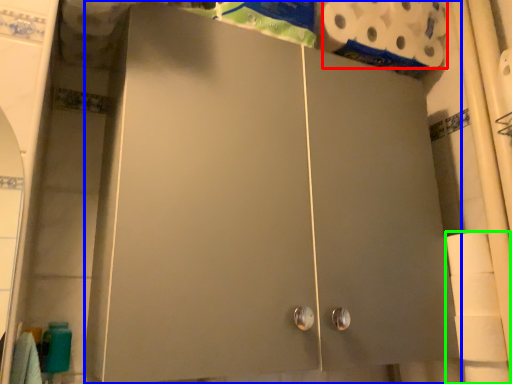
Question: Which object is positioned closest to toilet paper (highlighted by a red box)? Select from cupboard (highlighted by a blue box) and toilet paper (highlighted by a green box).

Choices:
 (A) cupboard
 (B) toilet paper

Answer: (A)